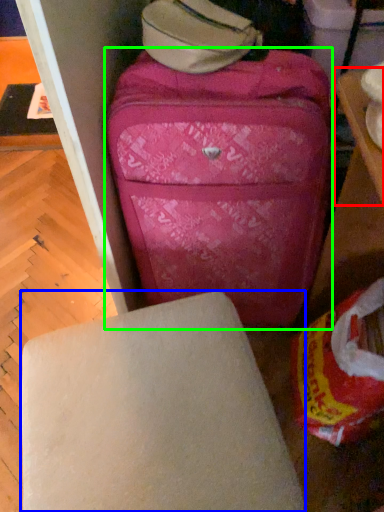
Question: Which is farther away from table (highlighted by a red box)? furniture (highlighted by a blue box) or suitcase (highlighted by a green box)?

Choices:
 (A) furniture
 (B) suitcase

Answer: (A)